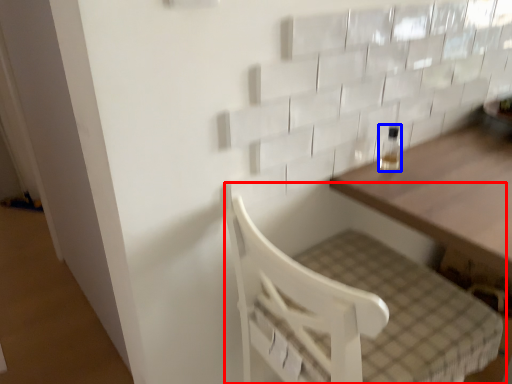
Question: Which object appears closest to the camera in this image, furniture (highlighted by a red box) or bottle (highlighted by a blue box)?

Choices:
 (A) furniture
 (B) bottle

Answer: (A)